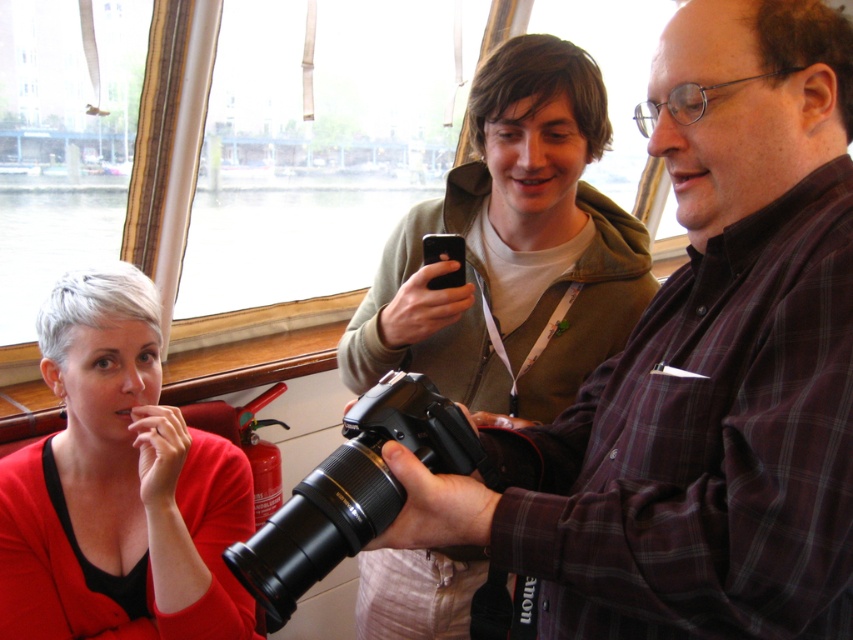
Does plaid fabric shirt at center have a lesser width compared to matte red sweater at lower left?

In fact, plaid fabric shirt at center might be wider than matte red sweater at lower left.

Is plaid fabric shirt at center above matte red sweater at lower left?

Indeed, plaid fabric shirt at center is positioned over matte red sweater at lower left.

The height and width of the screenshot is (640, 853). What do you see at coordinates (701, 371) in the screenshot? I see `plaid fabric shirt at center` at bounding box center [701, 371].

You are a GUI agent. You are given a task and a screenshot of the screen. Output one action in this format:
    pyautogui.click(x=<x>, y=<y>)
    Task: Click on the plaid fabric shirt at center
    
    Given the screenshot: What is the action you would take?
    pyautogui.click(x=701, y=371)

Can you confirm if plaid fabric shirt at center is taller than black plastic camera at center?

Yes.

Locate an element on the screen. The height and width of the screenshot is (640, 853). plaid fabric shirt at center is located at coordinates (701, 371).

This screenshot has height=640, width=853. In order to click on plaid fabric shirt at center in this screenshot , I will do `click(701, 371)`.

Between point (129, 600) and point (291, 522), which one is positioned in front?

Positioned in front is point (291, 522).

Find the location of a particular element. matte red sweater at lower left is located at coordinates (119, 486).

At what (x,y) coordinates should I click in order to perform the action: click on matte red sweater at lower left. Please return your answer as a coordinate pair (x, y). Image resolution: width=853 pixels, height=640 pixels. Looking at the image, I should click on (119, 486).